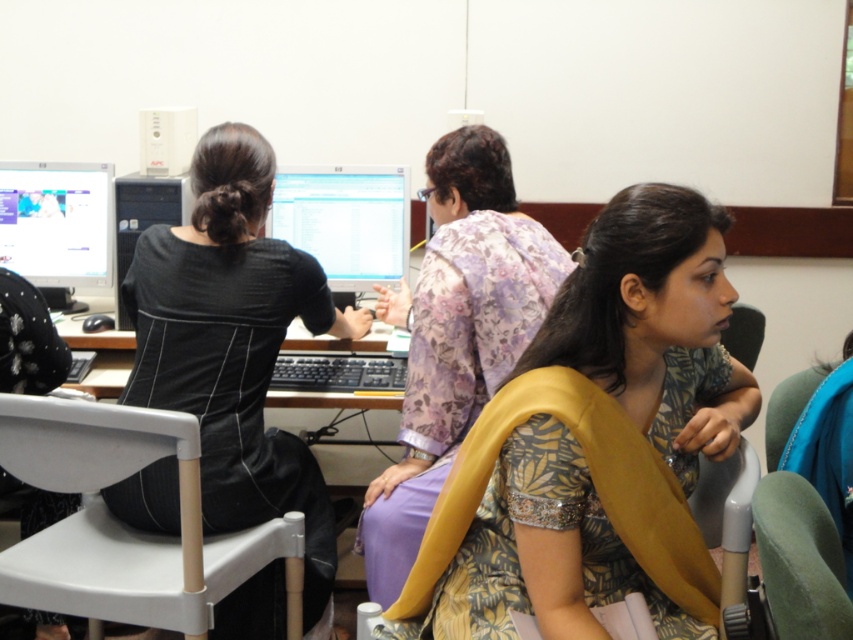
You are standing in the computer lab and see two points marked in the scene. Which point is closer to you, point (x=486, y=284) or point (x=171, y=214)?

Point (x=486, y=284) is closer to the viewer than point (x=171, y=214).

You are a photographer setting up a shoot in the computer lab. You need to position a light source to illuminate the black matte dress at center without casting a shadow on the white plastic chair at lower left. Based on their positions, where should you place the light source relative to the dress?

The black matte dress at center is located above the white plastic chair at lower left. To avoid casting a shadow on the chair, the light source should be placed directly above the dress so that the shadow falls behind it, away from the chair.